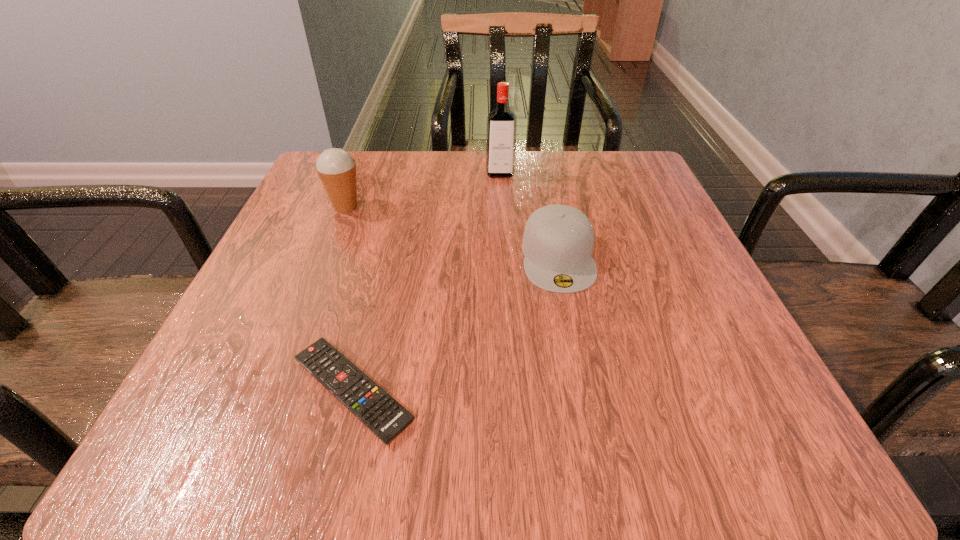
Where is `free space between the second nearest object and the remote control`? The height and width of the screenshot is (540, 960). free space between the second nearest object and the remote control is located at coordinates (455, 323).

Where is `empty location between the tallest object and the cap`? empty location between the tallest object and the cap is located at coordinates (529, 215).

Where is `free space that is in between the third farthest object and the icecream`? This screenshot has width=960, height=540. free space that is in between the third farthest object and the icecream is located at coordinates (452, 232).

I want to click on free space between the second nearest object and the icecream, so click(452, 232).

Identify the location of vacant area that lies between the tallest object and the shortest object. (426, 282).

The height and width of the screenshot is (540, 960). What are the coordinates of `the closest object to the third farthest object` in the screenshot? It's located at (501, 130).

Point out which object is positioned as the nearest to the remote control. Please provide its 2D coordinates. Your answer should be formatted as a tuple, i.e. [(x, y)], where the tuple contains the x and y coordinates of a point satisfying the conditions above.

[(558, 240)]